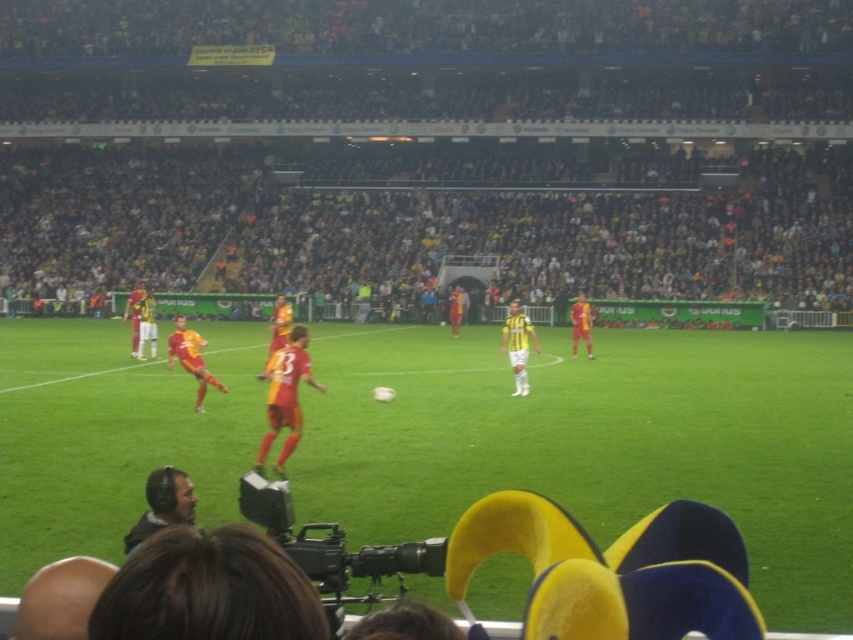
Does green grass football field at center have a greater height compared to orange jersey at center?

No, green grass football field at center is not taller than orange jersey at center.

Is green grass football field at center in front of orange jersey at center?

Yes, it is.

Between point (769, 397) and point (572, 355), which one is positioned behind?

The point (572, 355) is behind.

Identify the location of green grass football field at center. This screenshot has height=640, width=853. pos(595,442).

Can you confirm if green grass football field at center is thinner than yellow jersey at left?

No.

Between point (344, 362) and point (143, 358), which one is positioned behind?

Point (143, 358)

Image resolution: width=853 pixels, height=640 pixels. Find the location of `green grass football field at center`. green grass football field at center is located at coordinates (595, 442).

Measure the distance between yellow matte jersey at center and orange jersey at center.

The distance of yellow matte jersey at center from orange jersey at center is 12.20 feet.

Which is more to the left, yellow matte jersey at center or orange jersey at center?

yellow matte jersey at center

This screenshot has height=640, width=853. I want to click on yellow matte jersey at center, so click(x=518, y=346).